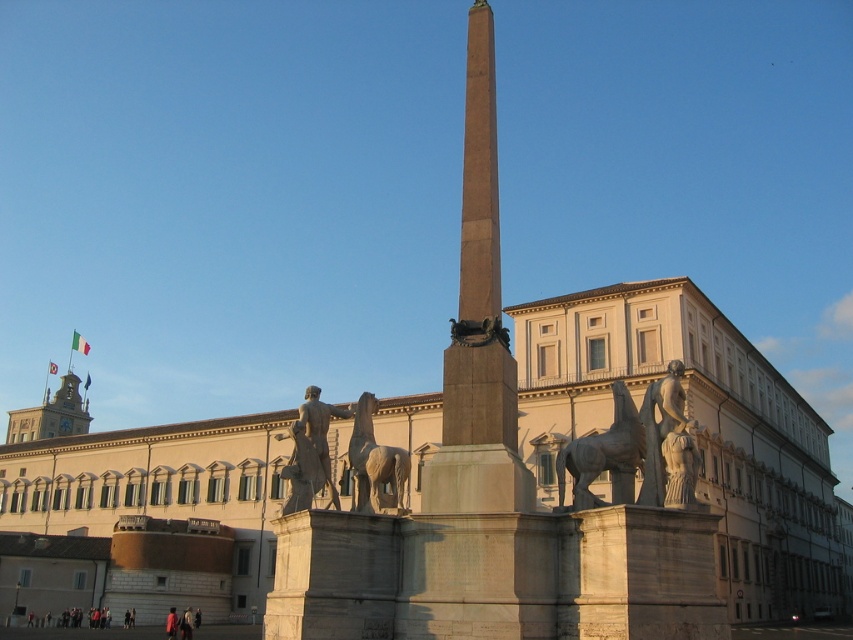
Question: From the image, what is the correct spatial relationship of white stone building at center in relation to polished bronze statue at center?

Choices:
 (A) left
 (B) right

Answer: (B)

Question: Can you confirm if polished bronze horse at center-right is positioned to the left of metallic clock tower at upper left?

Choices:
 (A) yes
 (B) no

Answer: (B)

Question: Among these points, which one is nearest to the camera?

Choices:
 (A) (18, 442)
 (B) (375, 461)
 (C) (335, 502)
 (D) (631, 406)

Answer: (B)

Question: Is polished stone statue at right to the left of metallic clock tower at upper left from the viewer's perspective?

Choices:
 (A) yes
 (B) no

Answer: (B)

Question: Which point is farther from the camera taking this photo?

Choices:
 (A) (642, 488)
 (B) (381, 506)
 (C) (828, 531)
 (D) (625, 392)

Answer: (C)

Question: Which of these objects is positioned closest to the metallic clock tower at upper left?

Choices:
 (A) polished stone horse at center
 (B) white stone building at center

Answer: (B)